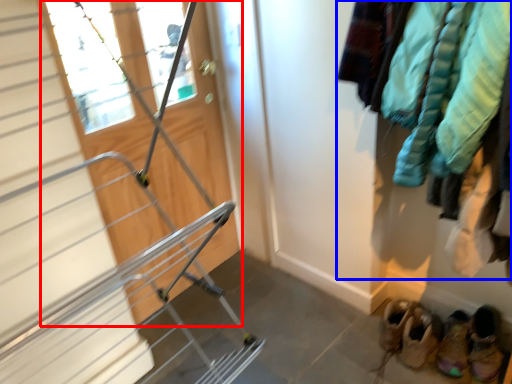
Question: Which object is further to the camera taking this photo, door (highlighted by a red box) or clothing (highlighted by a blue box)?

Choices:
 (A) door
 (B) clothing

Answer: (B)